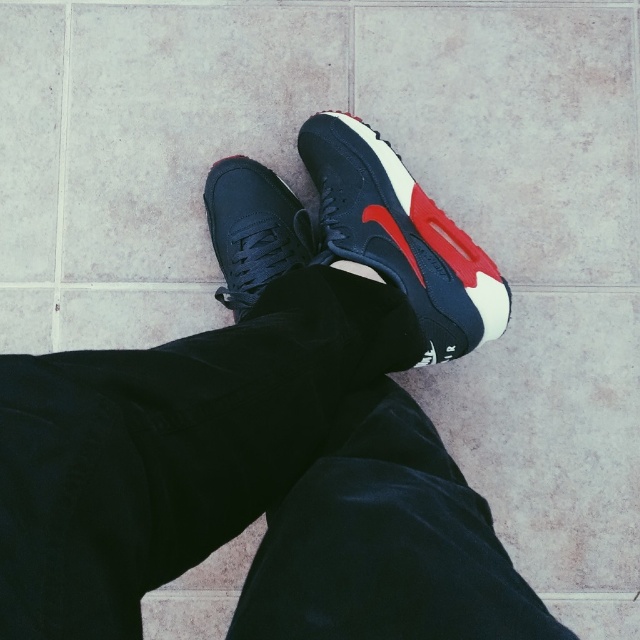
Consider the image. You are standing at the origin point of the coordinate system where the floor is the plane. The origin is at the bottom left corner of the image. The coordinates are given as x,y where x increases to the right and y increases upwards. You want to place a new object at the same position as the matte rubber shoe at center. What coordinates should you use?

The coordinates for the matte rubber shoe at center are at point (515, 129), so you should place the new object at coordinates (515, 129).

You are a photographer standing at a distance of 1.5 meters from the matte rubber shoe at center. You want to take a closeup photo of it. Do you need to move closer or farther away?

The matte rubber shoe at center is currently 1.22 meters away from you. Since you want to take a closeup photo, you need to move closer to reduce the distance between yourself and the shoe. Moving closer will allow you to capture more detail in the photo.

You are a photographer standing at a certain distance from the scene. You want to ensure that the point at coordinates point (x=209, y=216) is in focus. What is the minimum distance you should be from the camera to achieve this?

The point at coordinates point (x=209, y=216) is 1.21 meters away from the camera, so you should be at least 1.21 meters away from the camera to ensure it is in focus.